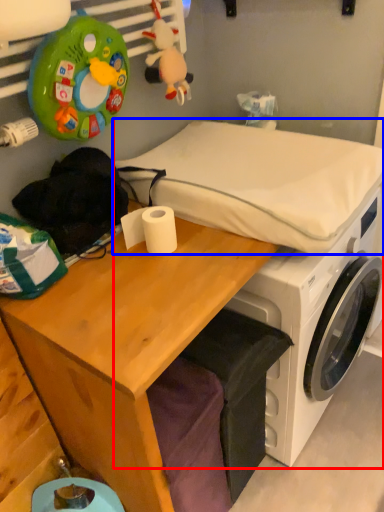
Question: Which point is further to the camera, machine (highlighted by a red box) or mattress (highlighted by a blue box)?

Choices:
 (A) machine
 (B) mattress

Answer: (A)